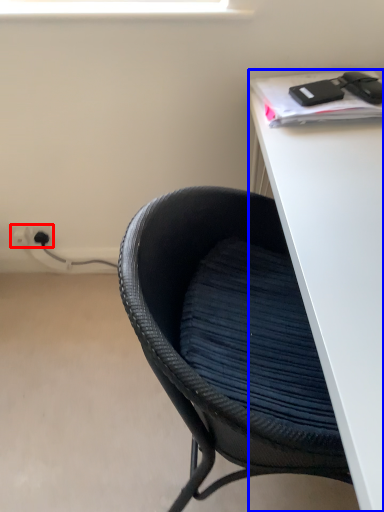
Question: Among these objects, which one is nearest to the camera, electric outlet (highlighted by a red box) or desk (highlighted by a blue box)?

Choices:
 (A) electric outlet
 (B) desk

Answer: (B)